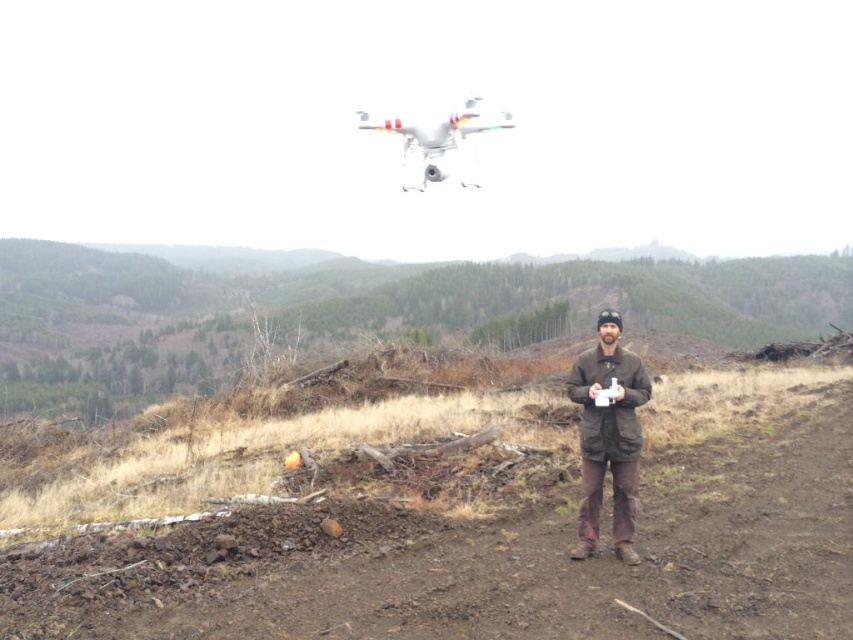
You are a photographer trying to capture a clear photo of the white matte drone at upper center. However, the brown woolen jacket at center is blocking your view. Can you move the drone to a position where it won not be obscured by the jacket?

The brown woolen jacket at center is in front of the white matte drone at upper center, so moving the drone to a position behind the jacket would prevent it from being obscured. Alternatively, moving the drone higher above the jacket or to the side where there is no obstruction would also work.

You are a photographer trying to capture a shot of the brown soil at center and the white matte drone at upper center. From your current position, which object is positioned to the right side of the other?

The brown soil at center is to the right of the white matte drone at upper center.

You are a photographer planning to take a portrait of the person in the scene. You want to ensure the brown woolen jacket at center and the brown soil at center are both visible in the frame. Based on their positions, which object should you focus on first to include both in the shot?

The brown woolen jacket at center is on the left side of the brown soil at center. To include both in the frame, focus on the brown woolen jacket at center first as it is closer to the left edge, then adjust to ensure the brown soil at center on the right is also in view.